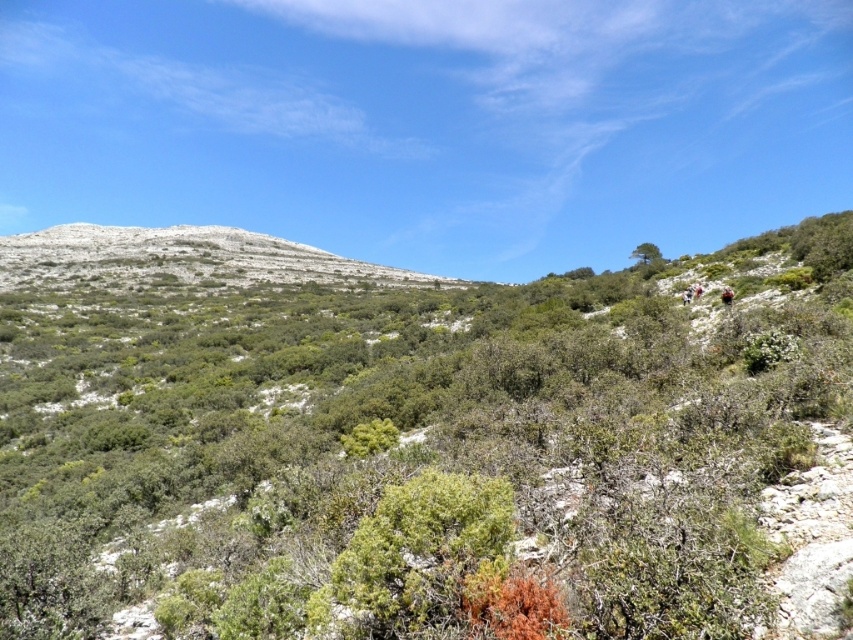
Between green shrubs at center and white rocky mountain at upper left, which one has less height?

Standing shorter between the two is green shrubs at center.

Between green shrubs at center and white rocky mountain at upper left, which one appears on the right side from the viewer's perspective?

green shrubs at center

Find the location of `green shrubs at center`. green shrubs at center is located at coordinates (407, 438).